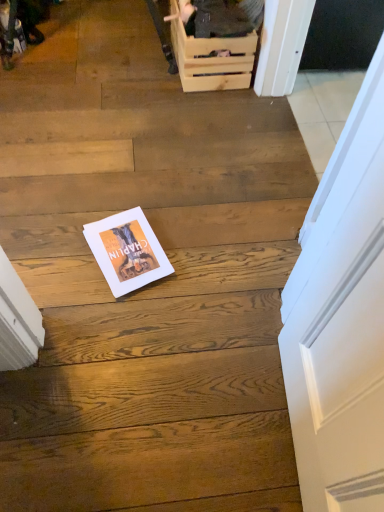
The width and height of the screenshot is (384, 512). I want to click on wooden crate at upper center, so click(x=222, y=17).

The height and width of the screenshot is (512, 384). Describe the element at coordinates (222, 17) in the screenshot. I see `wooden crate at upper center` at that location.

Where is `wooden crate at upper center`? wooden crate at upper center is located at coordinates (211, 56).

Which of these two, white paper magazine at center or wooden crate at upper center, is bigger?

wooden crate at upper center is bigger.

Relative to wooden crate at upper center, is white paper magazine at center in front or behind?

white paper magazine at center is positioned closer to the viewer than wooden crate at upper center.

Is white paper magazine at center facing towards wooden crate at upper center?

No, white paper magazine at center is not oriented towards wooden crate at upper center.

From a real-world perspective, is white paper magazine at center above or below wooden crate at upper center?

white paper magazine at center is below wooden crate at upper center.

Looking at this image, from a real-world perspective, is white paper magazine at center located beneath wooden crate at upper center?

Yes, from a real-world perspective, white paper magazine at center is below wooden crate at upper center.

I want to click on magazine below the wooden crate at upper center (from the image's perspective), so click(127, 251).

How different are the orientations of white paper magazine at center and wooden crate at upper center in degrees?

There is a 19-degree angle between the facing directions of white paper magazine at center and wooden crate at upper center.

Where is `drawer below the wooden crate at upper center (from a real-world perspective)`? drawer below the wooden crate at upper center (from a real-world perspective) is located at coordinates (211, 56).

Is wooden crate at upper center located within wooden crate at upper center?

Definitely not — wooden crate at upper center is not inside wooden crate at upper center.

Does wooden crate at upper center have a greater height compared to wooden crate at upper center?

Correct, wooden crate at upper center is much taller as wooden crate at upper center.

Based on the photo, who is bigger, wooden crate at upper center or wooden crate at upper center?

With larger size is wooden crate at upper center.

Looking at this image, which is more to the left, wooden crate at upper center or white paper magazine at center?

Positioned to the left is white paper magazine at center.

Considering the positions of objects wooden crate at upper center and white paper magazine at center in the image provided, who is in front, wooden crate at upper center or white paper magazine at center?

white paper magazine at center.

Is white paper magazine at center inside wooden crate at upper center?

No, white paper magazine at center is located outside of wooden crate at upper center.

Which of these two, wooden crate at upper center or white paper magazine at center, is bigger?

wooden crate at upper center is bigger.

Looking at their sizes, would you say wooden crate at upper center is wider or thinner than wooden crate at upper center?

Clearly, wooden crate at upper center has more width compared to wooden crate at upper center.

Is wooden crate at upper center at the back of wooden crate at upper center?

That's not correct — wooden crate at upper center is not looking away from wooden crate at upper center.

Based on the photo, does wooden crate at upper center lie behind wooden crate at upper center?

No, wooden crate at upper center is closer to the camera.

How far apart are wooden crate at upper center and wooden crate at upper center?

A distance of 4.04 inches exists between wooden crate at upper center and wooden crate at upper center.

This screenshot has width=384, height=512. What are the coordinates of `couple on the right of white paper magazine at center` in the screenshot? It's located at (222, 17).

How much distance is there between wooden crate at upper center and white paper magazine at center?

The distance of wooden crate at upper center from white paper magazine at center is 37.99 inches.

Which is closer, (262,9) or (112,237)?

The point (112,237) is in front.

Find the location of `magazine directly beneath the wooden crate at upper center (from a real-world perspective)`. magazine directly beneath the wooden crate at upper center (from a real-world perspective) is located at coordinates (127, 251).

Locate an element on the screen. This screenshot has width=384, height=512. magazine in front of the wooden crate at upper center is located at coordinates (127, 251).

Estimate the real-world distances between objects in this image. Which object is closer to wooden crate at upper center, white paper magazine at center or wooden crate at upper center?

wooden crate at upper center is positioned closer to the anchor wooden crate at upper center.

Based on their spatial positions, is wooden crate at upper center or wooden crate at upper center further from white paper magazine at center?

wooden crate at upper center.

Based on their spatial positions, is wooden crate at upper center or wooden crate at upper center further from white paper magazine at center?

wooden crate at upper center is further to white paper magazine at center.

Which object lies nearer to the anchor point wooden crate at upper center, wooden crate at upper center or white paper magazine at center?

The object closer to wooden crate at upper center is wooden crate at upper center.

From the image, which object appears to be farther from wooden crate at upper center, white paper magazine at center or wooden crate at upper center?

white paper magazine at center is further to wooden crate at upper center.

Which object lies further to the anchor point wooden crate at upper center, wooden crate at upper center or white paper magazine at center?

Among the two, white paper magazine at center is located further to wooden crate at upper center.

Where is `drawer between wooden crate at upper center and white paper magazine at center vertically`? The image size is (384, 512). drawer between wooden crate at upper center and white paper magazine at center vertically is located at coordinates point(211,56).